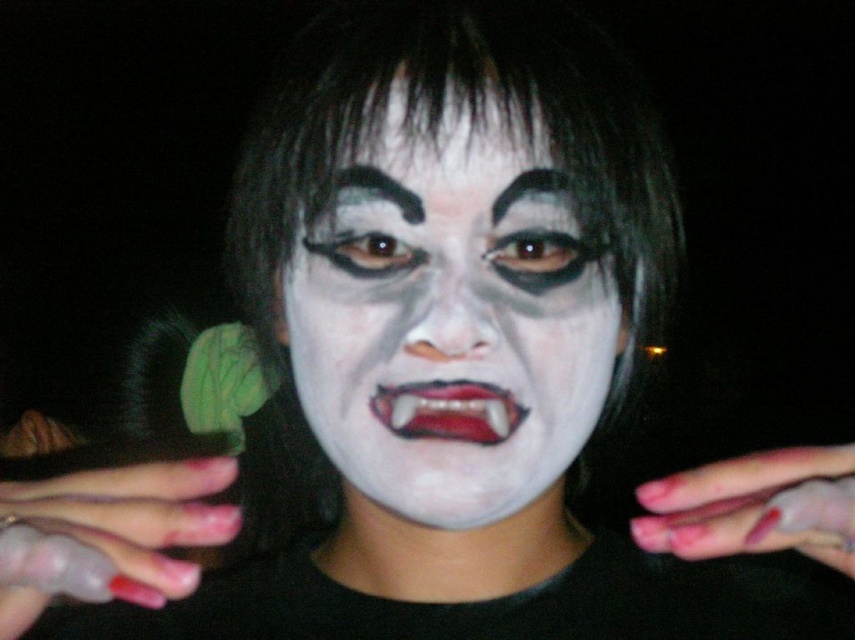
Who is positioned more to the right, white matte face at center or pink matte nails at center?

pink matte nails at center

Is white matte face at center below pink matte nails at center?

Incorrect, white matte face at center is not positioned below pink matte nails at center.

The width and height of the screenshot is (855, 640). Describe the element at coordinates (449, 321) in the screenshot. I see `white matte face at center` at that location.

You are a GUI agent. You are given a task and a screenshot of the screen. Output one action in this format:
    pyautogui.click(x=<x>, y=<y>)
    Task: Click on the white matte face at center
    Image resolution: width=855 pixels, height=640 pixels.
    Given the screenshot: What is the action you would take?
    pyautogui.click(x=449, y=321)

Does white matte face at center appear over glossy fingernails at lower left?

Indeed, white matte face at center is positioned over glossy fingernails at lower left.

Between point (352, 428) and point (192, 490), which one is positioned behind?

Positioned behind is point (352, 428).

Find the location of a particular element. This screenshot has width=855, height=640. white matte face at center is located at coordinates (449, 321).

Does glossy fingernails at lower left have a larger size compared to pink matte nails at center?

No, glossy fingernails at lower left is not bigger than pink matte nails at center.

Describe the element at coordinates (108, 536) in the screenshot. I see `glossy fingernails at lower left` at that location.

I want to click on glossy fingernails at lower left, so click(x=108, y=536).